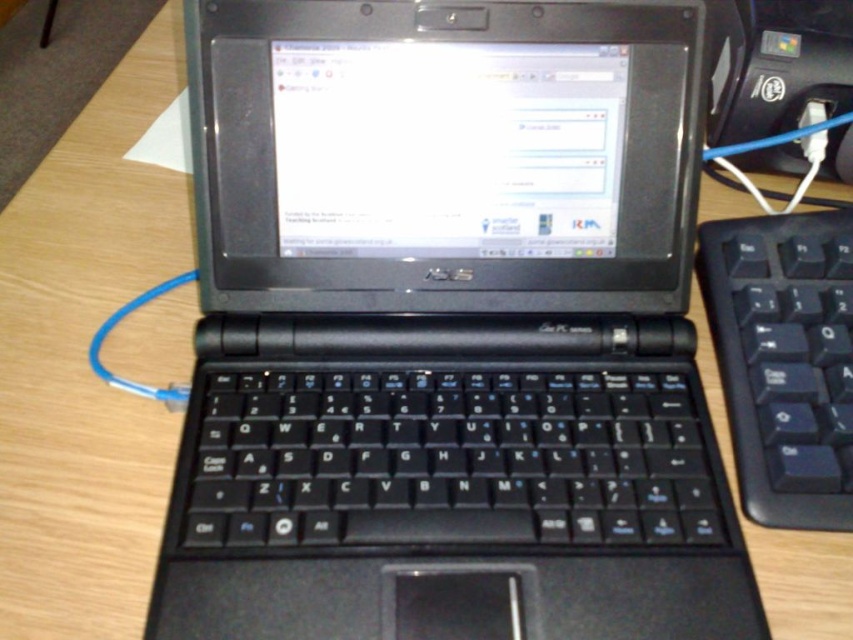
Question: Which point is farther to the camera?

Choices:
 (A) (476, 604)
 (B) (772, 374)

Answer: (B)

Question: Among these points, which one is farthest from the camera?

Choices:
 (A) (763, 467)
 (B) (657, 337)

Answer: (B)

Question: Estimate the real-world distances between objects in this image. Which object is closer to the black plastic laptop at center?

Choices:
 (A) black plastic keyboard at right
 (B) black plastic mouse at center

Answer: (A)

Question: Is black plastic laptop at center to the left of black plastic mouse at center from the viewer's perspective?

Choices:
 (A) yes
 (B) no

Answer: (A)

Question: Does black plastic laptop at center have a lesser width compared to black plastic keyboard at right?

Choices:
 (A) yes
 (B) no

Answer: (B)

Question: Does black plastic laptop at center appear on the left side of black plastic keyboard at right?

Choices:
 (A) yes
 (B) no

Answer: (A)